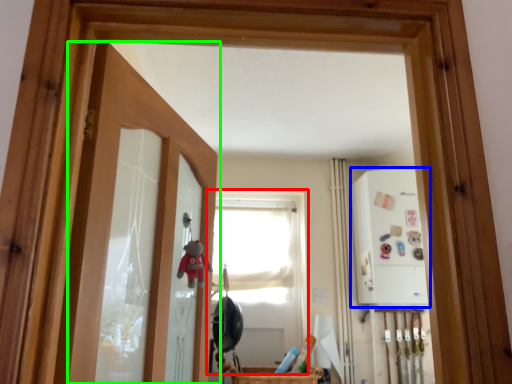
Question: Based on their relative distances, which object is nearer to window (highlighted by a red box)? Choose from medicine cabinet (highlighted by a blue box) and door (highlighted by a green box).

Choices:
 (A) medicine cabinet
 (B) door

Answer: (A)